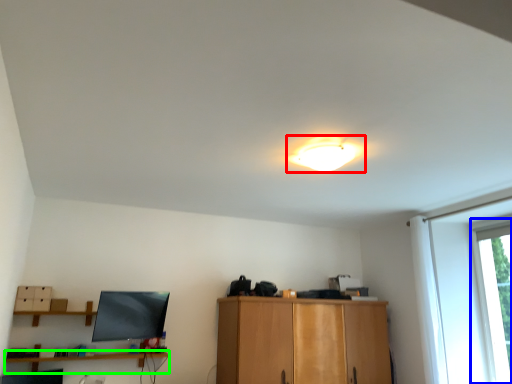
Question: Which is nearer to the lamp (highlighted by a red box)? window (highlighted by a blue box) or shelf (highlighted by a green box).

Choices:
 (A) window
 (B) shelf

Answer: (A)